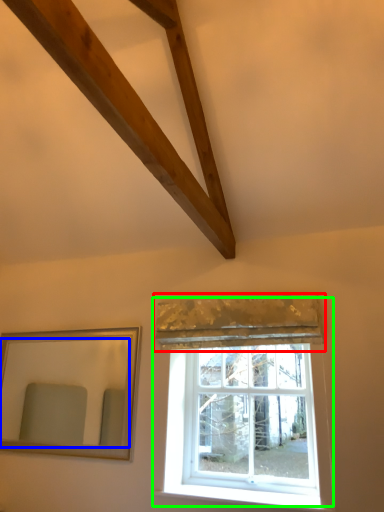
Question: Which object is positioned farthest from curtain (highlighted by a red box)? Select from mirror (highlighted by a blue box) and window (highlighted by a green box).

Choices:
 (A) mirror
 (B) window

Answer: (A)